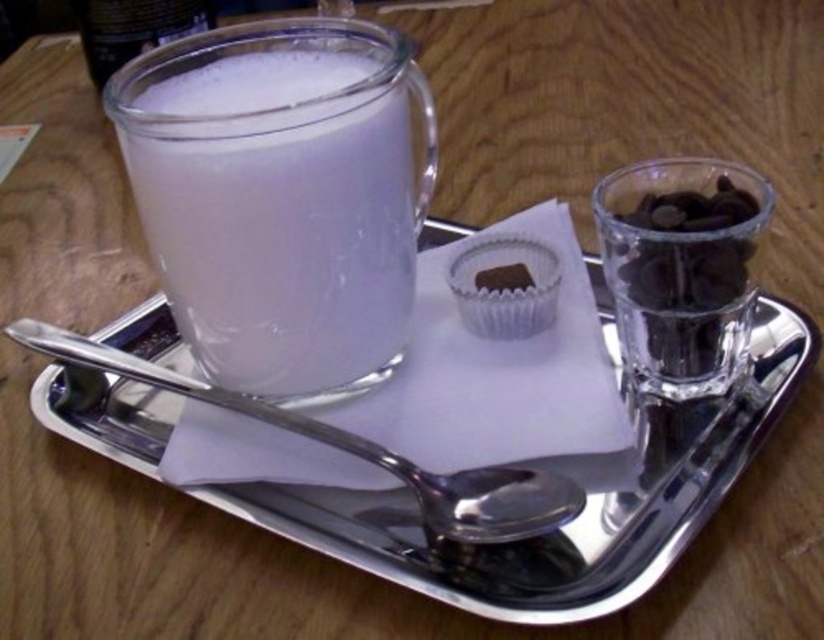
Question: Does silver metallic tray at center appear on the left side of translucent glass mug at upper center?

Choices:
 (A) yes
 (B) no

Answer: (B)

Question: Which of these objects is positioned closest to the silver metallic tray at center?

Choices:
 (A) brushed metal spoon at lower center
 (B) translucent glass mug at upper center
 (C) black chocolate at upper right
 (D) chocolate matte cupcake at center

Answer: (A)

Question: Does brushed metal spoon at lower center appear on the left side of translucent glass mug at upper center?

Choices:
 (A) no
 (B) yes

Answer: (A)

Question: Is silver metallic tray at center to the right of black chocolate at upper right from the viewer's perspective?

Choices:
 (A) yes
 (B) no

Answer: (B)

Question: Which point is closer to the camera?

Choices:
 (A) brushed metal spoon at lower center
 (B) translucent glass mug at upper center

Answer: (A)

Question: Which of the following is the closest to the observer?

Choices:
 (A) (492, 285)
 (B) (288, 428)
 (C) (736, 372)

Answer: (B)